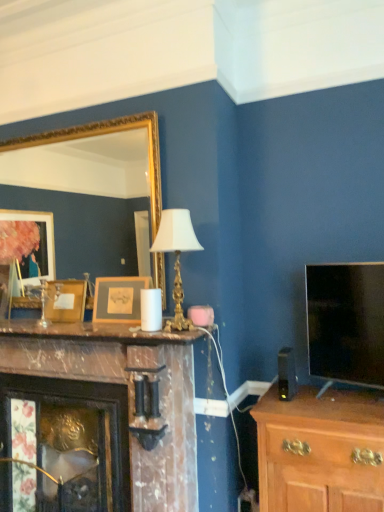
Question: From the image's perspective, does wooden picture frame at center, which is the 2th picture frame from left to right, appear higher than gold metallic table lamp at center?

Choices:
 (A) yes
 (B) no

Answer: (B)

Question: Considering the relative sizes of wooden picture frame at center, arranged as the first picture frame when viewed from the front, and gold metallic table lamp at center in the image provided, is wooden picture frame at center, arranged as the first picture frame when viewed from the front, taller than gold metallic table lamp at center?

Choices:
 (A) yes
 (B) no

Answer: (B)

Question: Is wooden picture frame at center, arranged as the first picture frame when viewed from the front, positioned far away from gold metallic table lamp at center?

Choices:
 (A) yes
 (B) no

Answer: (B)

Question: Is gold metallic table lamp at center completely or partially inside wooden picture frame at center, the second picture frame positioned from the back?

Choices:
 (A) no
 (B) yes

Answer: (A)

Question: Can you confirm if wooden picture frame at center, the second picture frame positioned from the back, is smaller than gold metallic table lamp at center?

Choices:
 (A) no
 (B) yes

Answer: (B)

Question: From the image's perspective, is flat-screen tv at right positioned above or below wooden picture frame at center, arranged as the first picture frame when viewed from the front?

Choices:
 (A) below
 (B) above

Answer: (A)

Question: Considering their positions, is flat-screen tv at right located in front of or behind wooden picture frame at center, arranged as the first picture frame when viewed from the front?

Choices:
 (A) behind
 (B) front

Answer: (B)

Question: From their relative heights in the image, would you say flat-screen tv at right is taller or shorter than wooden picture frame at center, acting as the first picture frame starting from the right?

Choices:
 (A) short
 (B) tall

Answer: (B)

Question: Is flat-screen tv at right bigger or smaller than wooden picture frame at center, arranged as the first picture frame when viewed from the front?

Choices:
 (A) big
 (B) small

Answer: (A)

Question: Based on their sizes in the image, would you say wooden picture frame at center, the second picture frame positioned from the back, is bigger or smaller than wooden picture frame at center-left, acting as the 1th picture frame starting from the back?

Choices:
 (A) small
 (B) big

Answer: (B)

Question: Considering the positions of wooden picture frame at center, acting as the first picture frame starting from the right, and wooden picture frame at center-left, which ranks as the 2th picture frame in front-to-back order, in the image, is wooden picture frame at center, acting as the first picture frame starting from the right, wider or thinner than wooden picture frame at center-left, which ranks as the 2th picture frame in front-to-back order,?

Choices:
 (A) wide
 (B) thin

Answer: (B)

Question: Is wooden picture frame at center, arranged as the first picture frame when viewed from the front, to the left or to the right of wooden picture frame at center-left, acting as the 1th picture frame starting from the back, in the image?

Choices:
 (A) right
 (B) left

Answer: (A)

Question: Would you say wooden picture frame at center, which is the 2th picture frame from left to right, is inside or outside wooden picture frame at center-left, arranged as the first picture frame when viewed from the left?

Choices:
 (A) inside
 (B) outside

Answer: (B)

Question: In the image, is marble fireplace at center positioned in front of or behind flat-screen tv at right?

Choices:
 (A) behind
 (B) front

Answer: (B)

Question: Based on their positions, is marble fireplace at center located to the left or right of flat-screen tv at right?

Choices:
 (A) right
 (B) left

Answer: (B)